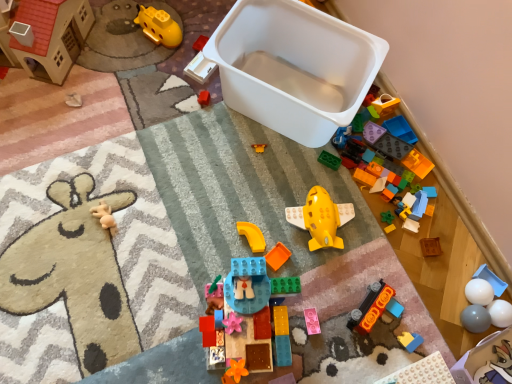
The image size is (512, 384). Find the location of `vacant space that's between yellow plastic submarine at upper left, which ranks as the fourteenth toy in right-to-left order, and yellow matte airplane at center, the ninth toy from the right`. vacant space that's between yellow plastic submarine at upper left, which ranks as the fourteenth toy in right-to-left order, and yellow matte airplane at center, the ninth toy from the right is located at coordinates (238, 139).